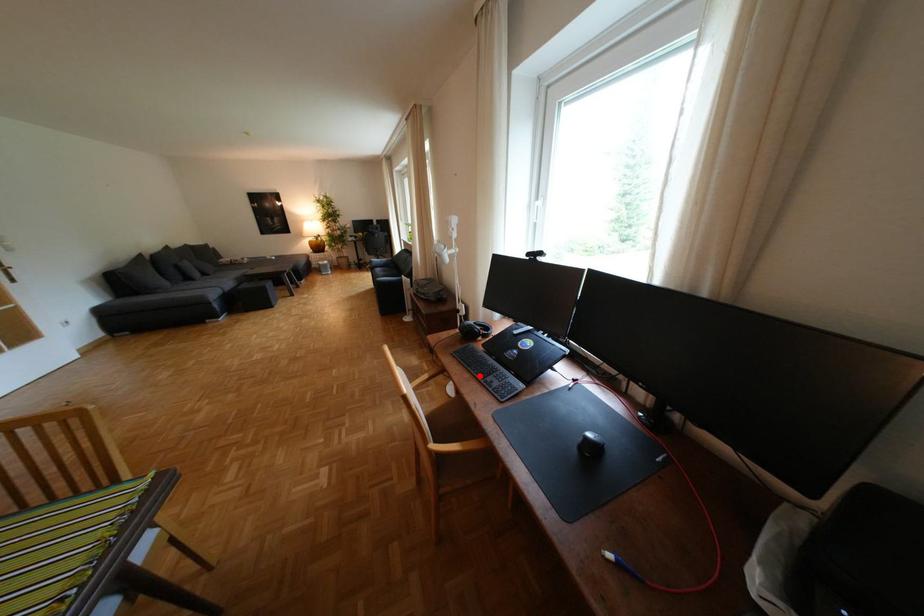
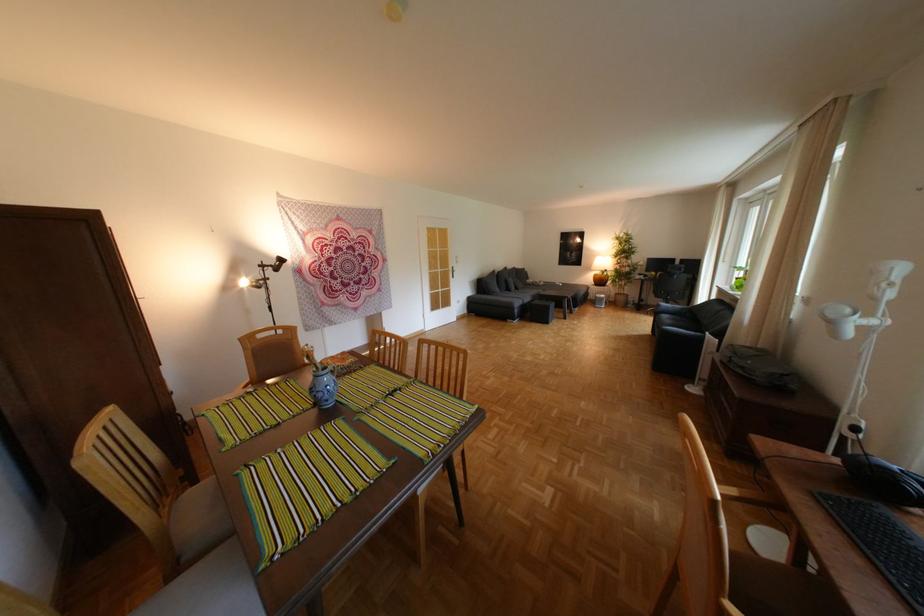
Where in the second image is the point corresponding to the highlighted location from the first image?

(870, 560)